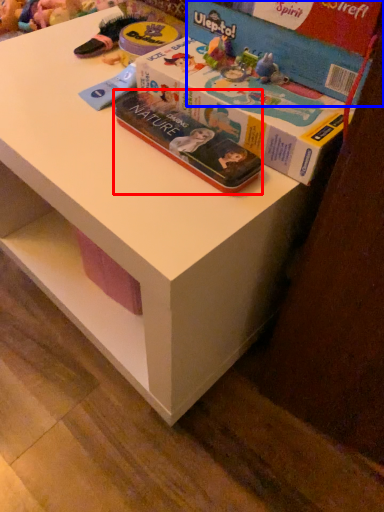
Question: Which object appears closest to the camera in this image, book (highlighted by a red box) or box (highlighted by a blue box)?

Choices:
 (A) book
 (B) box

Answer: (B)